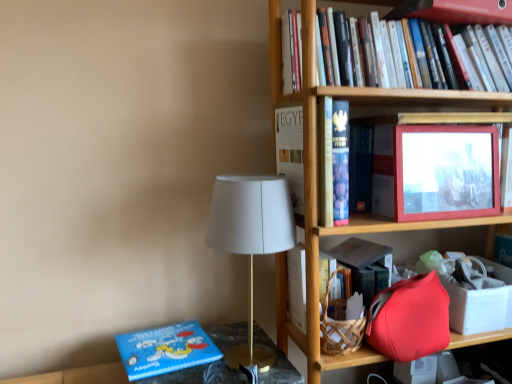
What is the approximate height of matte red shoulder bag at lower right?

8.63 inches.

Image resolution: width=512 pixels, height=384 pixels. What do you see at coordinates (410, 319) in the screenshot?
I see `matte red shoulder bag at lower right` at bounding box center [410, 319].

Find the location of `matte red picture frame at upper right`. matte red picture frame at upper right is located at coordinates (445, 172).

Locate an element on the screen. The height and width of the screenshot is (384, 512). white matte box at right is located at coordinates (478, 308).

Which is correct: hardcover book at center is inside white matte table lamp at center, or outside of it?

The correct answer is: outside.

From a real-world perspective, which object stands above the other?

In real-world perspective, white matte table lamp at center is above.

How different are the orientations of hardcover book at center and white matte table lamp at center in degrees?

1.72 degrees.

From the image's perspective, which is above, white matte box at right or hardcover book at center?

From the image's view, hardcover book at center is above.

Is white matte box at right positioned in front of hardcover book at center?

Yes, white matte box at right is closer to the camera.

Is white matte box at right oriented towards hardcover book at center?

No.

Who is taller, white matte box at right or hardcover book at center?

hardcover book at center.

Considering the sizes of white matte table lamp at center and blue matte board book at lower left, which is the second book in top-to-bottom order, in the image, is white matte table lamp at center taller or shorter than blue matte board book at lower left, which is the second book in top-to-bottom order,?

white matte table lamp at center is taller than blue matte board book at lower left, which is the second book in top-to-bottom order.

Looking at this image, would you say white matte table lamp at center is to the left or to the right of blue matte board book at lower left, positioned as the first book in left-to-right order, in the picture?

From the image, it's evident that white matte table lamp at center is to the right of blue matte board book at lower left, positioned as the first book in left-to-right order.

Is blue matte board book at lower left, which is the second book in top-to-bottom order, a part of white matte table lamp at center?

No, blue matte board book at lower left, which is the second book in top-to-bottom order, is located outside of white matte table lamp at center.

Could you tell me if white matte table lamp at center is facing blue matte board book at lower left, which is the second book in top-to-bottom order?

No, white matte table lamp at center is not oriented towards blue matte board book at lower left, which is the second book in top-to-bottom order.

From a real-world perspective, does matte red picture frame at upper right sit lower than matte red shoulder bag at lower right?

No.

Considering the sizes of matte red picture frame at upper right and matte red shoulder bag at lower right in the image, is matte red picture frame at upper right wider or thinner than matte red shoulder bag at lower right?

Considering their sizes, matte red picture frame at upper right looks slimmer than matte red shoulder bag at lower right.

Is point (481, 158) closer or farther from the camera than point (439, 343)?

Clearly, point (481, 158) is more distant from the camera than point (439, 343).

From a real-world perspective, between matte red shoulder bag at lower right and hardcover book at center, who is vertically higher?

hardcover book at center is physically above.

Considering the relative sizes of matte red shoulder bag at lower right and hardcover book at center in the image provided, is matte red shoulder bag at lower right shorter than hardcover book at center?

No.

Considering the positions of point (398, 315) and point (387, 280), is point (398, 315) closer or farther from the camera than point (387, 280)?

Point (398, 315) is positioned closer to the camera compared to point (387, 280).

Which object is thinner, matte red shoulder bag at lower right or hardcover book at center?

matte red shoulder bag at lower right is thinner.

What's the angular difference between matte red shoulder bag at lower right and hardcover book at upper right, the second book from the left,'s facing directions?

1.13 degrees.

Are matte red shoulder bag at lower right and hardcover book at upper right, the second book from the left, beside each other?

No, matte red shoulder bag at lower right is not making contact with hardcover book at upper right, the second book from the left.

Would you say hardcover book at upper right, which ranks as the second book in bottom-to-top order, is part of matte red shoulder bag at lower right's contents?

No, hardcover book at upper right, which ranks as the second book in bottom-to-top order, is not inside matte red shoulder bag at lower right.

Is matte red shoulder bag at lower right at the right side of hardcover book at upper right, the first book when ordered from right to left?

In fact, matte red shoulder bag at lower right is to the left of hardcover book at upper right, the first book when ordered from right to left.

Between point (475, 303) and point (248, 249), which one is positioned in front?

Positioned in front is point (248, 249).

Where is `table lamp above the white matte box at right (from a real-world perspective)`? Image resolution: width=512 pixels, height=384 pixels. table lamp above the white matte box at right (from a real-world perspective) is located at coordinates 251,238.

From a real-world perspective, is white matte box at right physically above white matte table lamp at center?

Actually, white matte box at right is physically below white matte table lamp at center in the real world.

Who is smaller, white matte box at right or white matte table lamp at center?

Smaller between the two is white matte box at right.

Find the location of a particular element. The width and height of the screenshot is (512, 384). table lamp above the hardcover book at center (from the image's perspective) is located at coordinates (251, 238).

Where is `box on the right of hardcover book at center`? This screenshot has height=384, width=512. box on the right of hardcover book at center is located at coordinates (478, 308).

From the image, which object appears to be farther from white matte table lamp at center, hardcover book at center or matte red shoulder bag at lower right?

Based on the image, matte red shoulder bag at lower right appears to be further to white matte table lamp at center.

Considering their positions, is blue matte board book at lower left, positioned as the first book in bottom-to-top order, positioned further to white matte box at right than matte red shoulder bag at lower right?

blue matte board book at lower left, positioned as the first book in bottom-to-top order.

When comparing their distances from hardcover book at upper right, which ranks as the second book in bottom-to-top order, does hardcover book at center or matte red shoulder bag at lower right seem closer?

hardcover book at center is closer to hardcover book at upper right, which ranks as the second book in bottom-to-top order.

From the picture: When comparing their distances from hardcover book at center, does white matte table lamp at center or hardcover book at upper right, the 1th book viewed from the top, seem further?

hardcover book at upper right, the 1th book viewed from the top, is further to hardcover book at center.

From the image, which object appears to be farther from hardcover book at upper right, the 1th book viewed from the top, hardcover book at center or matte red picture frame at upper right?

hardcover book at center is positioned further to the anchor hardcover book at upper right, the 1th book viewed from the top.

Looking at this image, considering their positions, is matte red picture frame at upper right positioned further to hardcover book at upper right, the 1th book viewed from the top, than white matte box at right?

white matte box at right lies further to hardcover book at upper right, the 1th book viewed from the top, than the other object.

Looking at this image, when comparing their distances from white matte table lamp at center, does hardcover book at upper right, the first book when ordered from right to left, or hardcover book at center seem further?

hardcover book at upper right, the first book when ordered from right to left, lies further to white matte table lamp at center than the other object.

From the picture: Considering their positions, is hardcover book at upper right, the 1th book viewed from the top, positioned further to blue matte board book at lower left, positioned as the first book in left-to-right order, than white matte table lamp at center?

hardcover book at upper right, the 1th book viewed from the top, lies further to blue matte board book at lower left, positioned as the first book in left-to-right order, than the other object.

I want to click on picture frame between hardcover book at upper right, the second book from the left, and matte red shoulder bag at lower right in the up-down direction, so click(x=445, y=172).

Identify the location of table lamp between blue matte board book at lower left, which is the second book in top-to-bottom order, and matte red picture frame at upper right from left to right. The image size is (512, 384). (251, 238).

Locate an element on the screen. picture frame situated between white matte table lamp at center and white matte box at right from left to right is located at coordinates (445, 172).

The height and width of the screenshot is (384, 512). Find the location of `shoulder bag situated between blue matte board book at lower left, marked as the second book in a right-to-left arrangement, and matte red picture frame at upper right from left to right`. shoulder bag situated between blue matte board book at lower left, marked as the second book in a right-to-left arrangement, and matte red picture frame at upper right from left to right is located at coordinates (410, 319).